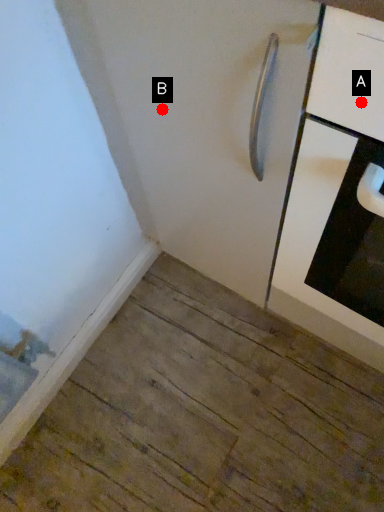
Question: Two points are circled on the image, labeled by A and B beside each circle. Which point is further to the camera?

Choices:
 (A) A is further
 (B) B is further

Answer: (B)